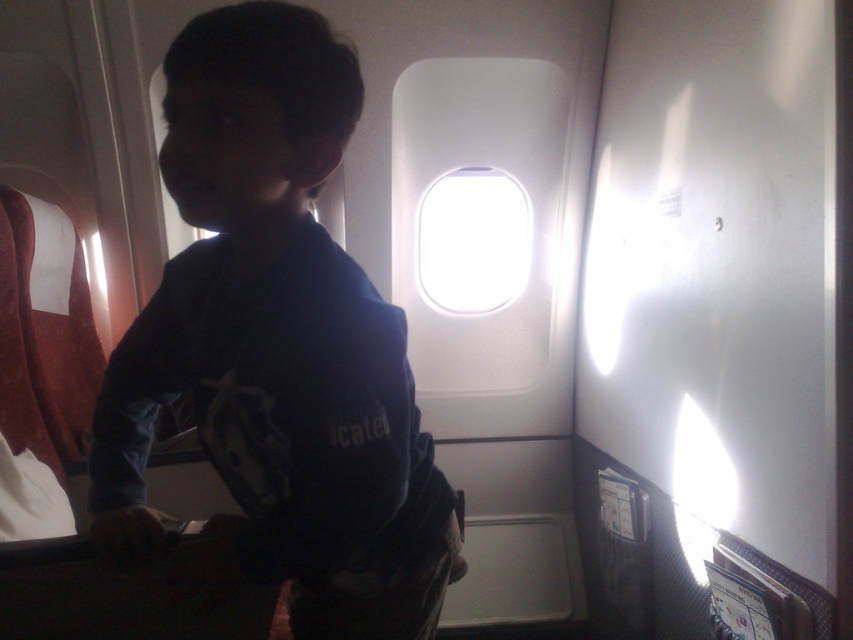
Looking at this image, can you confirm if dark blue shirt at center is positioned above transparent glass airplane window at center?

No.

Who is higher up, dark blue shirt at center or transparent glass airplane window at center?

transparent glass airplane window at center is above.

Which is in front, point (444, 580) or point (489, 216)?

Point (444, 580) is in front.

Identify the location of dark blue shirt at center. (277, 346).